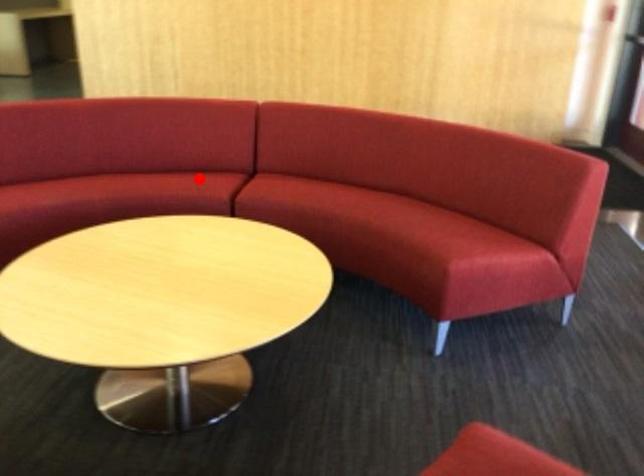
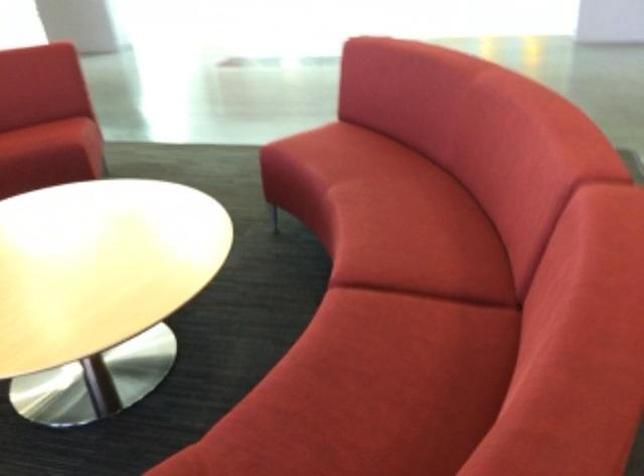
Question: A red point is marked in image1. In image2, is the corresponding 3D point closer to the camera or farther? Reply with the corresponding letter.

Choices:
 (A) The corresponding 3D point is closer.
 (B) The corresponding 3D point is farther.

Answer: (A)